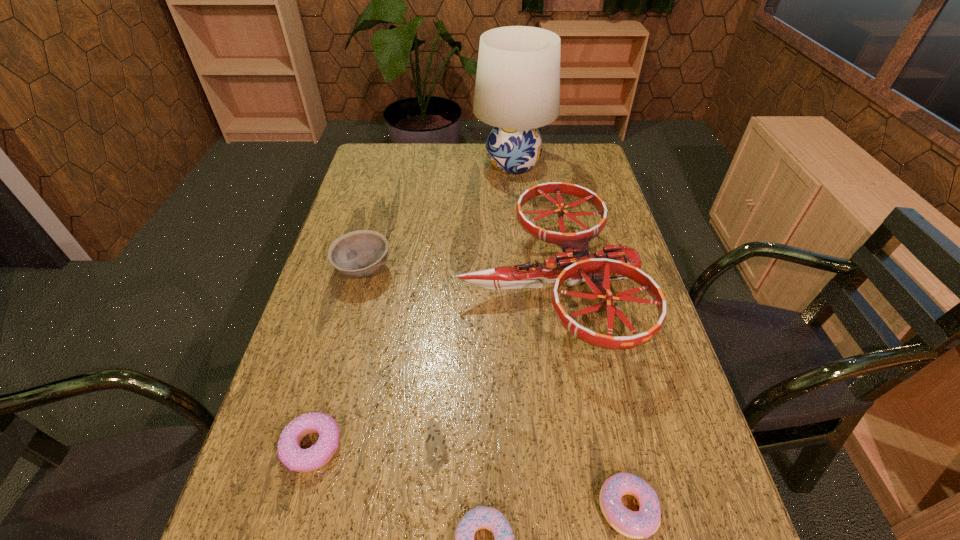
I want to click on lampshade, so 517,90.

Where is `the farthest object`? This screenshot has width=960, height=540. the farthest object is located at coordinates (517, 90).

Locate an element on the screen. The height and width of the screenshot is (540, 960). the second tallest object is located at coordinates (576, 264).

The height and width of the screenshot is (540, 960). In order to click on the fourth shortest object in this screenshot , I will do `click(357, 254)`.

This screenshot has width=960, height=540. Find the location of `the fourth farthest object`. the fourth farthest object is located at coordinates click(290, 453).

Locate an element on the screen. The width and height of the screenshot is (960, 540). the leftmost doughnut is located at coordinates (290, 453).

This screenshot has width=960, height=540. Find the location of `free region located 0.150m on the front-facing side of the tallest object`. free region located 0.150m on the front-facing side of the tallest object is located at coordinates (433, 164).

Locate an element on the screen. free space located 0.140m on the front-facing side of the tallest object is located at coordinates (436, 164).

This screenshot has height=540, width=960. In order to click on vacant space located 0.300m on the front-facing side of the tallest object in this screenshot , I will do `click(393, 164)`.

Locate an element on the screen. free spot located 0.140m on the left of the drone is located at coordinates (406, 284).